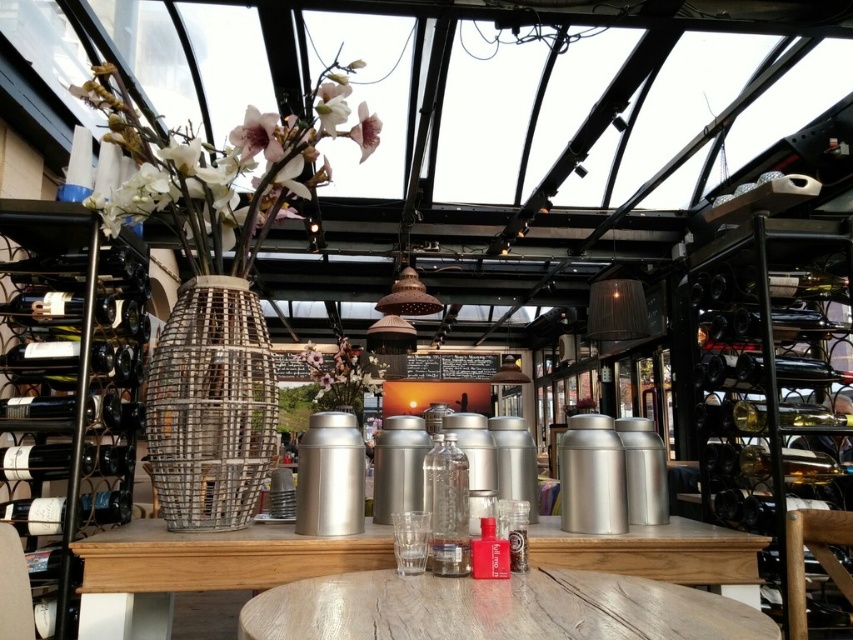
Looking at this image, you are a customer at the cafe and want to place your phone on the table. The metallic woven basket at center and the pink matte flower at upper center are already there. Which object should you move to make space?

You should move the metallic woven basket at center because it is to the left of the pink matte flower at upper center, so moving it would create space on the right side of the flower.

You are a server in the cafe and need to place a 12 inch long tray between the metallic woven basket at center and the dark green glass wine bottle at left. Can you fit the tray there without moving either object?

The distance between the metallic woven basket at center and the dark green glass wine bottle at left is 11.68 inches, which is slightly shorter than the 12 inch tray. Therefore, the tray cannot be placed between them without moving either object.

You are a customer at the cafe and want to place your phone on the table so it stays within 25 inches of the pink matte flower at upper center. Can you put it on the metallic woven basket at center?

The metallic woven basket at center is 27.29 inches from the pink matte flower at upper center, so placing the phone on the basket would exceed the 25 inches distance requirement. Choose another spot closer to the pink matte flower at upper center.